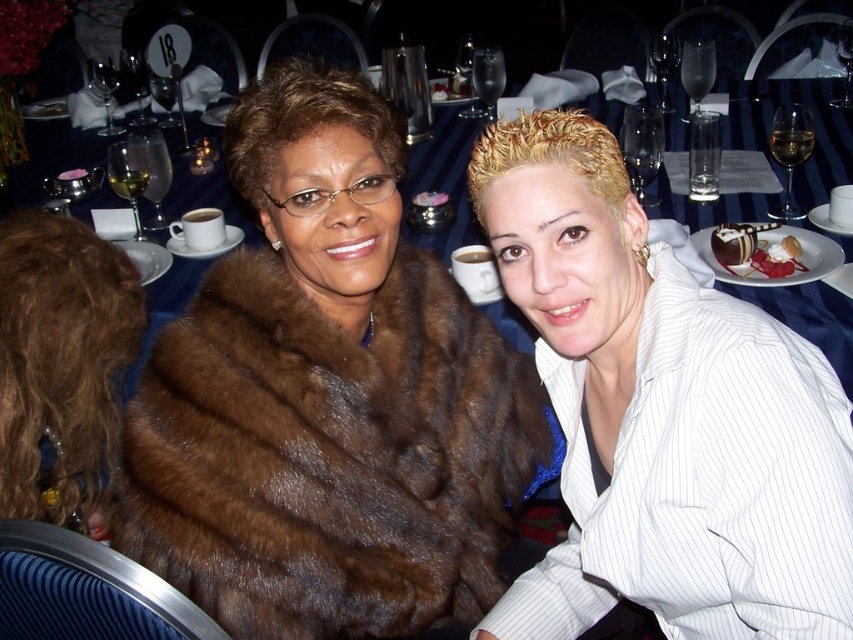
Does point (268, 285) come farther from viewer compared to point (738, 240)?

No, (268, 285) is closer to viewer.

Can you confirm if brown fur coat at center is positioned to the left of chocolate glazed cake at right?

Yes, brown fur coat at center is to the left of chocolate glazed cake at right.

I want to click on brown fur coat at center, so click(329, 454).

Where is `brown fur coat at center`? brown fur coat at center is located at coordinates (329, 454).

Does white striped shirt at center come behind blue fabric table at center?

No, white striped shirt at center is in front of blue fabric table at center.

Which is behind, point (607, 560) or point (430, 140)?

The point (430, 140) is behind.

Is point (718, 376) positioned before point (820, 136)?

That is True.

Locate an element on the screen. Image resolution: width=853 pixels, height=640 pixels. white striped shirt at center is located at coordinates (660, 413).

Between white striped shirt at center and chocolate glazed cake at right, which one has more height?

white striped shirt at center

Locate an element on the screen. Image resolution: width=853 pixels, height=640 pixels. white striped shirt at center is located at coordinates (660, 413).

The image size is (853, 640). I want to click on white striped shirt at center, so click(660, 413).